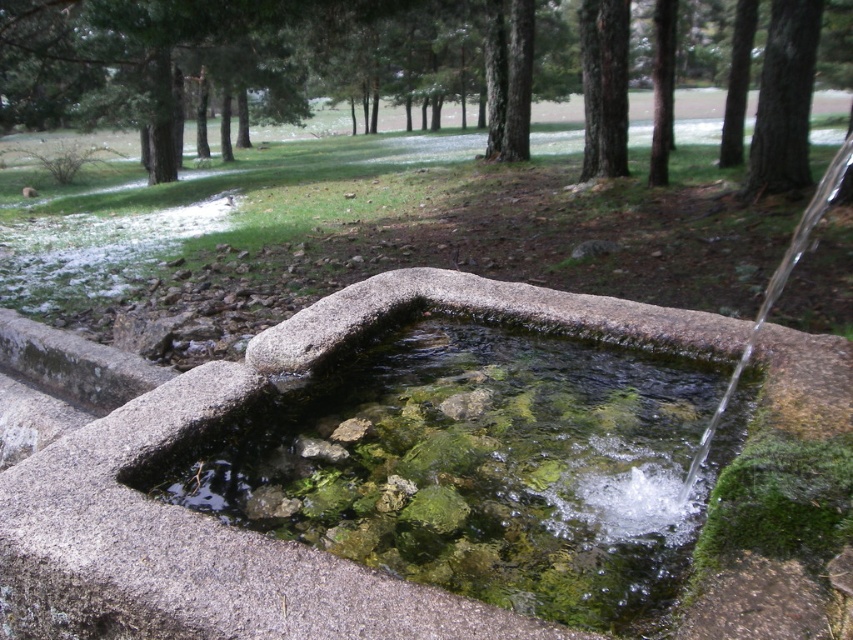
You are a bird looking for a nesting spot. You see the green leafy tree at upper center and the dark brown bark tree at upper right. Which tree would you choose if you want to build your nest higher up?

The green leafy tree at upper center is taller than the dark brown bark tree at upper right, so you should choose the green leafy tree at upper center to build your nest higher up.

Based on the photo, you are standing at the edge of the stone water fountain basin. There is a green mossy stone marked by point (485, 468) at center. If you want to reach the mossy stone, which direction should you move from your current position?

The green mossy stone at center is located at the center of the basin, so you should move towards the center of the basin to reach it.

Looking at this image, you are standing in the scene and want to place a small decorative statue between the green mossy stone at center and the dark brown bark tree at upper right. Based on their positions, which object should the statue be closer to?

The statue should be closer to the green mossy stone at center because it is positioned on the left side of the dark brown bark tree at upper right, so the distance between them allows placing the statue near the stone.